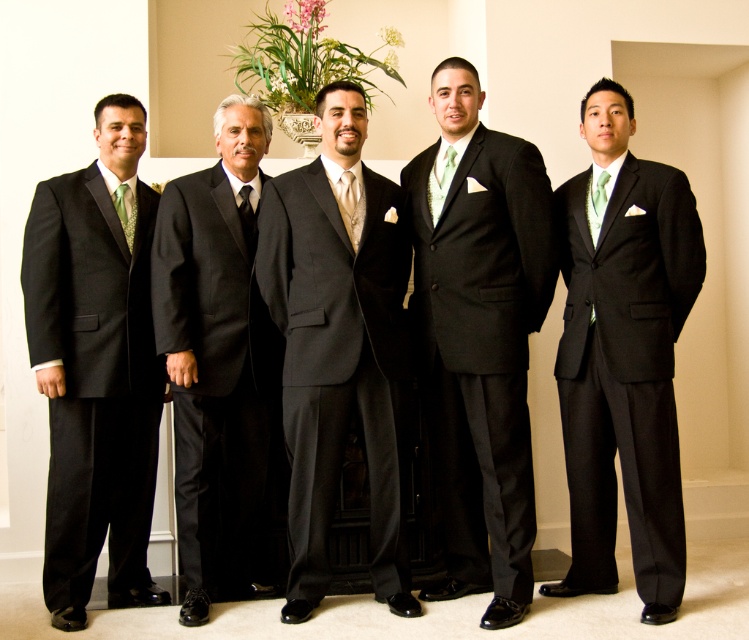
You are a photographer setting up for a group photo. The subjects are wearing a matte black suit at center and a green satin tie at right. You need to position a microphone stand between them. What is the minimum width required for the microphone stand to fit between them without touching either subject?

The distance between the matte black suit at center and the green satin tie at right is 23.54 inches. Therefore, the microphone stand must be less than 23.54 inches wide to fit between them without touching either subject.

You are a photographer adjusting your camera settings to capture the group photo. You notice the matte black suit at center and the green satin tie at right. Which object should you focus on first to ensure both are in sharp focus, considering their positions?

The matte black suit at center is closer to the viewer than the green satin tie at right, so you should focus on the matte black suit at center first to ensure both are in sharp focus.

You are a photographer setting up for a group photo. You notice the matte black suit at left and the black satin suit at center. Which of these two suits is closer to the decorative fireplace with a dark frame?

The matte black suit at left is positioned under the black satin suit at center, so the black satin suit at center is closer to the decorative fireplace.